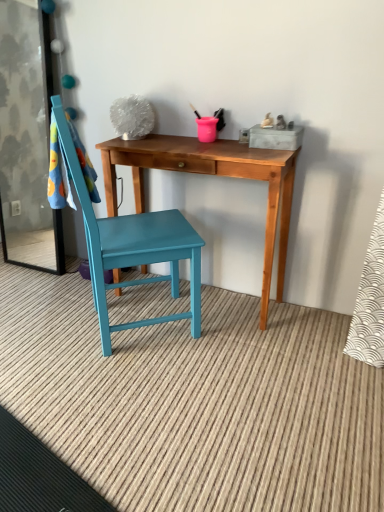
Identify the location of empty space that is in between wooden desk at center and teal painted wood chair at center. This screenshot has width=384, height=512. (213, 336).